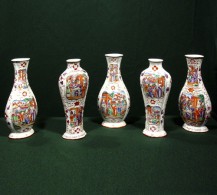
What are the coordinates of `vase with widest part at bottom` in the screenshot? It's located at (116, 105), (201, 106), (25, 111).